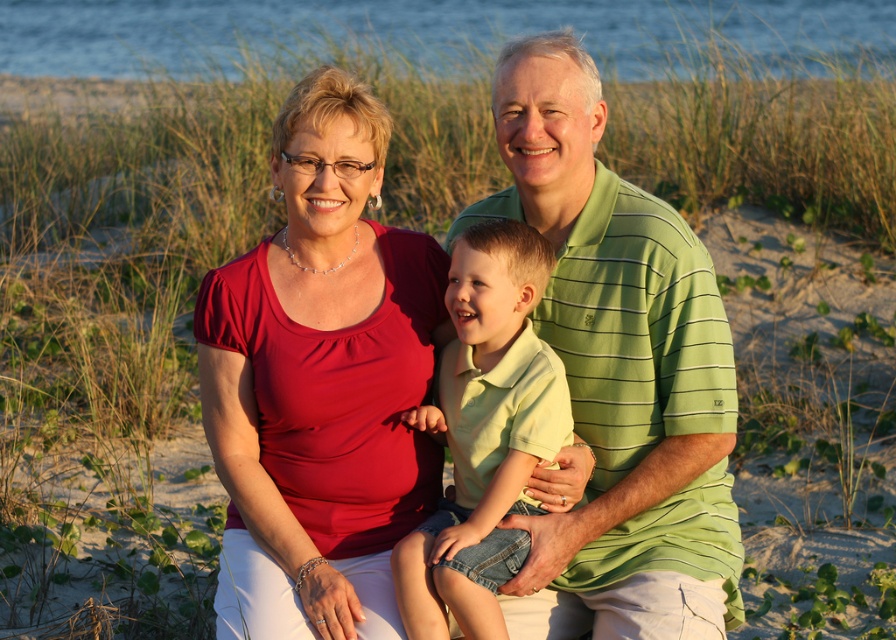
Does matte red blouse at center have a larger size compared to green striped polo shirt at center?

Incorrect, matte red blouse at center is not larger than green striped polo shirt at center.

From the picture: Does matte red blouse at center have a greater width compared to green striped polo shirt at center?

No, matte red blouse at center is not wider than green striped polo shirt at center.

This screenshot has height=640, width=896. What do you see at coordinates (321, 381) in the screenshot? I see `matte red blouse at center` at bounding box center [321, 381].

Where is `matte red blouse at center`? The image size is (896, 640). matte red blouse at center is located at coordinates (321, 381).

Who is higher up, matte red blouse at center or green cotton shirt at center?

Positioned higher is matte red blouse at center.

Find the location of a particular element. This screenshot has width=896, height=640. matte red blouse at center is located at coordinates (321, 381).

Who is positioned more to the left, green striped polo shirt at center or green cotton shirt at center?

green cotton shirt at center

Which of these two, green striped polo shirt at center or green cotton shirt at center, stands taller?

green striped polo shirt at center is taller.

The width and height of the screenshot is (896, 640). What do you see at coordinates (617, 376) in the screenshot?
I see `green striped polo shirt at center` at bounding box center [617, 376].

Locate an element on the screen. The width and height of the screenshot is (896, 640). green striped polo shirt at center is located at coordinates (617, 376).